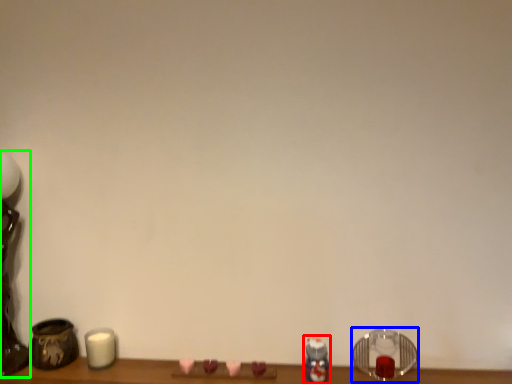
Question: Considering the real-world distances, which object is farthest from toy (highlighted by a red box)? candle holder (highlighted by a blue box) or table lamp (highlighted by a green box)?

Choices:
 (A) candle holder
 (B) table lamp

Answer: (B)